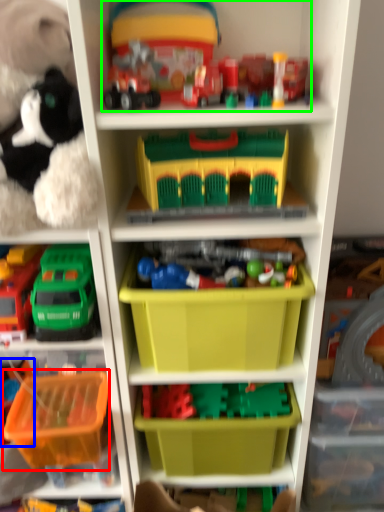
Question: Which is farther away from storage box (highlighted by a red box)? toy (highlighted by a blue box) or toy (highlighted by a green box)?

Choices:
 (A) toy
 (B) toy

Answer: (B)